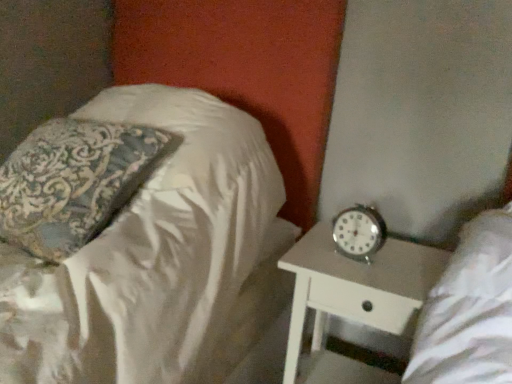
Image resolution: width=512 pixels, height=384 pixels. I want to click on vacant region in front of metallic silver clock at right, so click(x=372, y=271).